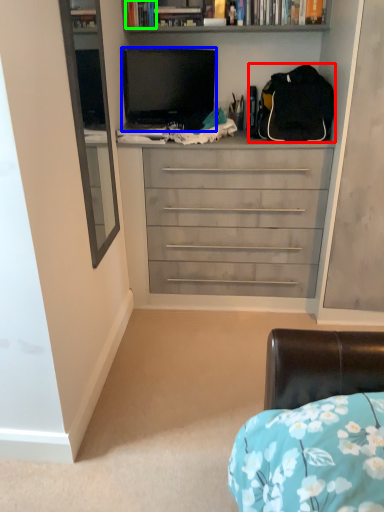
Question: Based on their relative distances, which object is farther from backpack (highlighted by a red box)? Choose from television (highlighted by a blue box) and book (highlighted by a green box).

Choices:
 (A) television
 (B) book

Answer: (B)